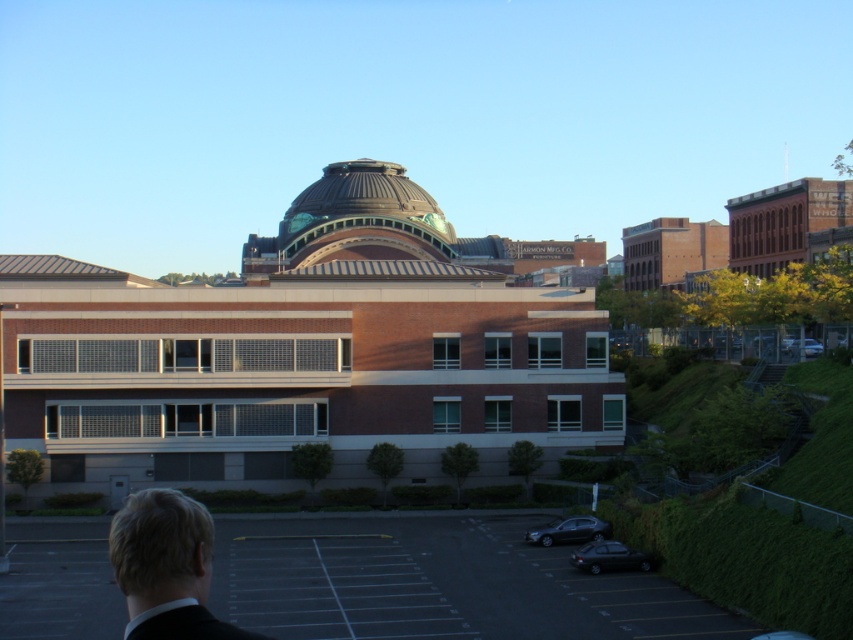
Does point (347, 246) come behind point (788, 339)?

Yes, point (347, 246) is farther from viewer.

At what (x,y) coordinates should I click in order to perform the action: click on gold metallic dome at center. Please return your answer as a coordinate pair (x, y). The image size is (853, 640). Looking at the image, I should click on (357, 228).

Is shiny black car at lower right below shiny black sedan at lower right?

Indeed, shiny black car at lower right is positioned under shiny black sedan at lower right.

Can you confirm if shiny black car at lower right is bigger than shiny black sedan at lower right?

No.

Who is more distant from viewer, (573, 556) or (566, 529)?

The point (566, 529) is behind.

Where is `shiny black car at lower right`? shiny black car at lower right is located at coordinates 608,557.

Which is more to the right, black asphalt parking lot at lower center or shiny black car at lower right?

shiny black car at lower right is more to the right.

Which is in front, point (74, 602) or point (590, 557)?

Point (74, 602) is more forward.

The height and width of the screenshot is (640, 853). Find the location of `black asphalt parking lot at lower center`. black asphalt parking lot at lower center is located at coordinates (438, 584).